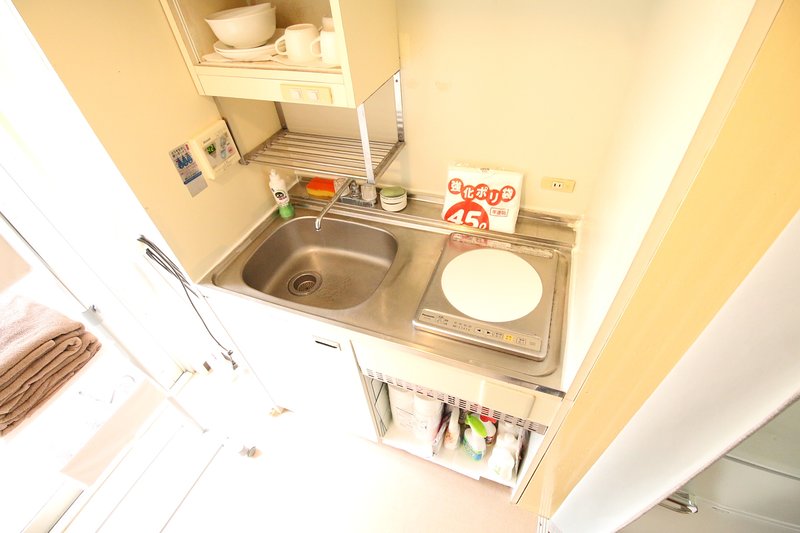
Identify the location of electrical outlet. The image size is (800, 533). (548, 182).